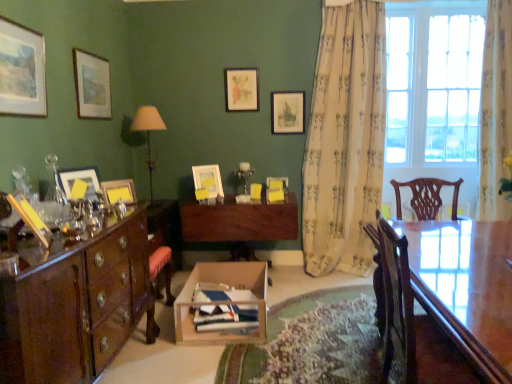
Question: Do you think matte pink picture frame at upper center, the seventh picture frame in the front-to-back sequence, is within matte white picture frame at center, which is the 3th picture frame from back to front, or outside of it?

Choices:
 (A) inside
 (B) outside

Answer: (B)

Question: From the image's perspective, is matte pink picture frame at upper center, the seventh picture frame in the front-to-back sequence, located above or below matte white picture frame at center, which ranks as the sixth picture frame in front-to-back order?

Choices:
 (A) below
 (B) above

Answer: (B)

Question: Which of these objects is positioned farthest from the matte white picture frame at center, which ranks as the sixth picture frame in front-to-back order?

Choices:
 (A) matte pink picture frame at upper center, the sixth picture frame viewed from the left
 (B) floral fabric curtain at right, which appears as the second curtain when viewed from the left
 (C) cardboard box at center
 (D) floral-patterned fabric curtain at right, which is the 2th curtain in right-to-left order
 (E) glossy wood table at right

Answer: (E)

Question: Which of these objects is positioned closest to the matte white picture frame at center, which is the 3th picture frame from back to front?

Choices:
 (A) polished wood cabinet at left
 (B) matte black picture frame at upper center, the eighth picture frame positioned from the left
 (C) matte white picture frame at left, the seventh picture frame when ordered from back to front
 (D) matte cream fabric lampshade at left
 (E) dark wood desk at center

Answer: (B)